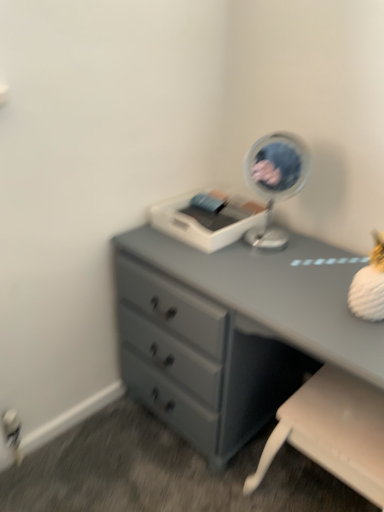
Question: Does metallic silver mirror at upper right have a smaller size compared to white plastic swivel chair at lower right?

Choices:
 (A) yes
 (B) no

Answer: (A)

Question: Can you confirm if metallic silver mirror at upper right is positioned to the right of white plastic swivel chair at lower right?

Choices:
 (A) no
 (B) yes

Answer: (A)

Question: Is metallic silver mirror at upper right taller than white plastic swivel chair at lower right?

Choices:
 (A) yes
 (B) no

Answer: (B)

Question: Is metallic silver mirror at upper right outside of white plastic swivel chair at lower right?

Choices:
 (A) no
 (B) yes

Answer: (B)

Question: Is metallic silver mirror at upper right thinner than white plastic swivel chair at lower right?

Choices:
 (A) no
 (B) yes

Answer: (B)

Question: Based on their sizes in the image, would you say matte gray dresser at center is bigger or smaller than white plastic printer at center?

Choices:
 (A) small
 (B) big

Answer: (B)

Question: Is matte gray dresser at center wider or thinner than white plastic printer at center?

Choices:
 (A) wide
 (B) thin

Answer: (A)

Question: Considering their positions, is matte gray dresser at center located in front of or behind white plastic printer at center?

Choices:
 (A) front
 (B) behind

Answer: (A)

Question: Is matte gray dresser at center spatially inside white plastic printer at center, or outside of it?

Choices:
 (A) inside
 (B) outside

Answer: (B)

Question: In terms of size, does matte gray dresser at center appear bigger or smaller than metallic silver mirror at upper right?

Choices:
 (A) big
 (B) small

Answer: (A)

Question: In terms of height, does matte gray dresser at center look taller or shorter compared to metallic silver mirror at upper right?

Choices:
 (A) short
 (B) tall

Answer: (B)

Question: From the image's perspective, is matte gray dresser at center positioned above or below metallic silver mirror at upper right?

Choices:
 (A) below
 (B) above

Answer: (A)

Question: From a real-world perspective, is matte gray dresser at center physically located above or below metallic silver mirror at upper right?

Choices:
 (A) above
 (B) below

Answer: (B)

Question: Is white plastic printer at center wider or thinner than matte gray dresser at center?

Choices:
 (A) thin
 (B) wide

Answer: (A)

Question: In the image, is white plastic printer at center positioned in front of or behind matte gray dresser at center?

Choices:
 (A) behind
 (B) front

Answer: (A)